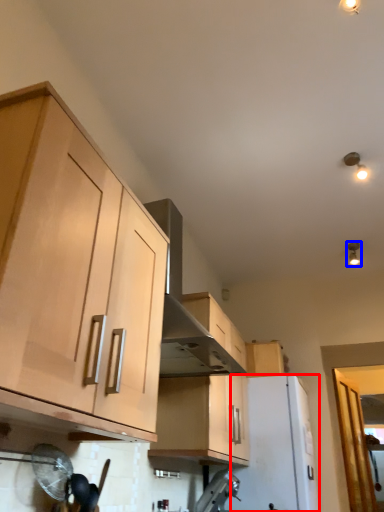
Question: Which object is closer to the camera taking this photo, appliance (highlighted by a red box) or light fixture (highlighted by a blue box)?

Choices:
 (A) appliance
 (B) light fixture

Answer: (A)